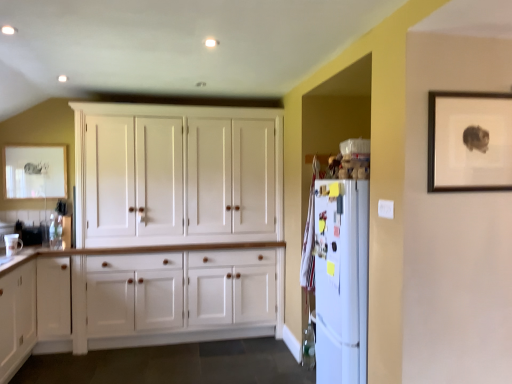
Question: Is wooden picture frame at upper right, the second picture frame in the back-to-front sequence, with white wood cupboard at center?

Choices:
 (A) yes
 (B) no

Answer: (B)

Question: Would you say wooden picture frame at upper right, which is counted as the 2th picture frame, starting from the left, contains white wood cupboard at center?

Choices:
 (A) no
 (B) yes

Answer: (A)

Question: Is wooden picture frame at upper right, the second picture frame in the back-to-front sequence, taller than white wood cupboard at center?

Choices:
 (A) no
 (B) yes

Answer: (A)

Question: From a real-world perspective, is wooden picture frame at upper right, the second picture frame in the back-to-front sequence, located beneath white wood cupboard at center?

Choices:
 (A) no
 (B) yes

Answer: (A)

Question: Would you say wooden picture frame at upper right, marked as the 1th picture frame in a front-to-back arrangement, is outside white wood cupboard at center?

Choices:
 (A) no
 (B) yes

Answer: (B)

Question: Is the depth of wooden picture frame at upper right, marked as the 1th picture frame in a front-to-back arrangement, less than that of white wood cupboard at center?

Choices:
 (A) no
 (B) yes

Answer: (B)

Question: Could you tell me if white wood cabinet at lower left is turned towards matte white picture frame at upper left, which is counted as the first picture frame, starting from the back?

Choices:
 (A) no
 (B) yes

Answer: (A)

Question: Is white wood cabinet at lower left positioned behind matte white picture frame at upper left, the second picture frame in the right-to-left sequence?

Choices:
 (A) yes
 (B) no

Answer: (B)

Question: Considering the relative sizes of white wood cabinet at lower left and matte white picture frame at upper left, the second picture frame viewed from the front, in the image provided, is white wood cabinet at lower left bigger than matte white picture frame at upper left, the second picture frame viewed from the front,?

Choices:
 (A) yes
 (B) no

Answer: (A)

Question: Can you confirm if white wood cabinet at lower left is taller than matte white picture frame at upper left, which is counted as the first picture frame, starting from the back?

Choices:
 (A) no
 (B) yes

Answer: (B)

Question: Can you confirm if white wood cabinet at lower left is positioned to the right of matte white picture frame at upper left, the second picture frame in the right-to-left sequence?

Choices:
 (A) yes
 (B) no

Answer: (A)

Question: Is white wood cabinet at lower left positioned far away from matte white picture frame at upper left, the second picture frame viewed from the front?

Choices:
 (A) yes
 (B) no

Answer: (A)

Question: Is wooden picture frame at upper right, marked as the 1th picture frame in a front-to-back arrangement, far away from white wood cabinet at lower left?

Choices:
 (A) no
 (B) yes

Answer: (B)